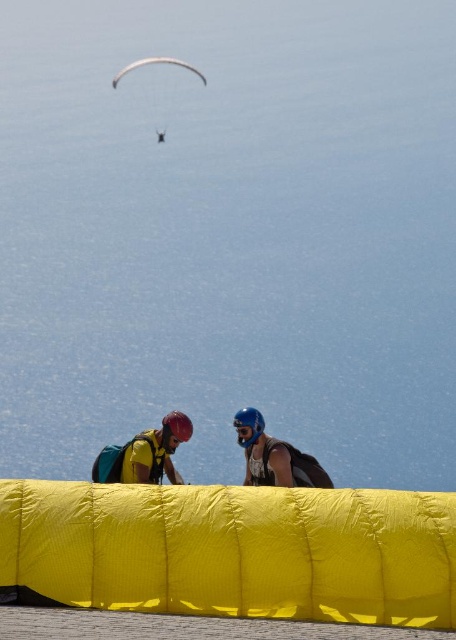
Between point (172, 580) and point (115, 80), which one is positioned behind?

The point (115, 80) is more distant.

Find the location of a particular element. Image resolution: width=456 pixels, height=640 pixels. yellow fabric parachute at center is located at coordinates (232, 552).

How far apart are blue matte helmet at center and white glossy parachute at upper center?

blue matte helmet at center and white glossy parachute at upper center are 15.18 meters apart from each other.

Is blue matte helmet at center above white glossy parachute at upper center?

No.

This screenshot has height=640, width=456. What do you see at coordinates (274, 456) in the screenshot? I see `blue matte helmet at center` at bounding box center [274, 456].

At what (x,y) coordinates should I click in order to perform the action: click on blue matte helmet at center. Please return your answer as a coordinate pair (x, y). This screenshot has height=640, width=456. Looking at the image, I should click on (274, 456).

Which is more to the left, yellow fabric parachute at center or blue matte helmet at center?

yellow fabric parachute at center is more to the left.

Between point (241, 618) and point (264, 442), which one is positioned behind?

The point (264, 442) is more distant.

The width and height of the screenshot is (456, 640). Describe the element at coordinates (232, 552) in the screenshot. I see `yellow fabric parachute at center` at that location.

This screenshot has width=456, height=640. I want to click on yellow fabric parachute at center, so click(x=232, y=552).